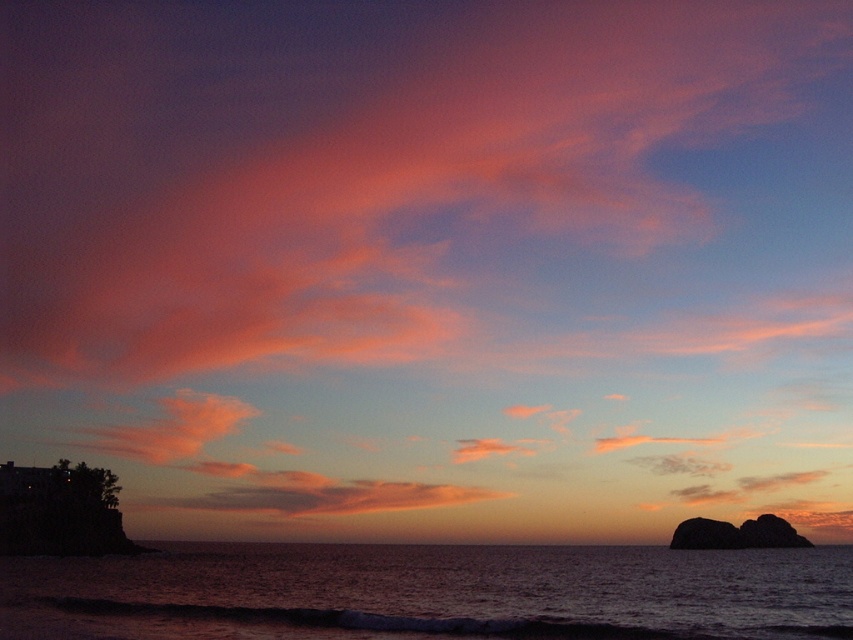
Question: Does dark blue water at lower center lie in front of smooth dark rock at lower right?

Choices:
 (A) no
 (B) yes

Answer: (B)

Question: Which object appears closest to the camera in this image?

Choices:
 (A) smooth dark rock at lower right
 (B) dark blue water at lower center

Answer: (B)

Question: Can you confirm if dark blue water at lower center is positioned to the right of smooth dark rock at lower right?

Choices:
 (A) yes
 (B) no

Answer: (B)

Question: Can you confirm if dark blue water at lower center is thinner than smooth dark rock at lower right?

Choices:
 (A) no
 (B) yes

Answer: (A)